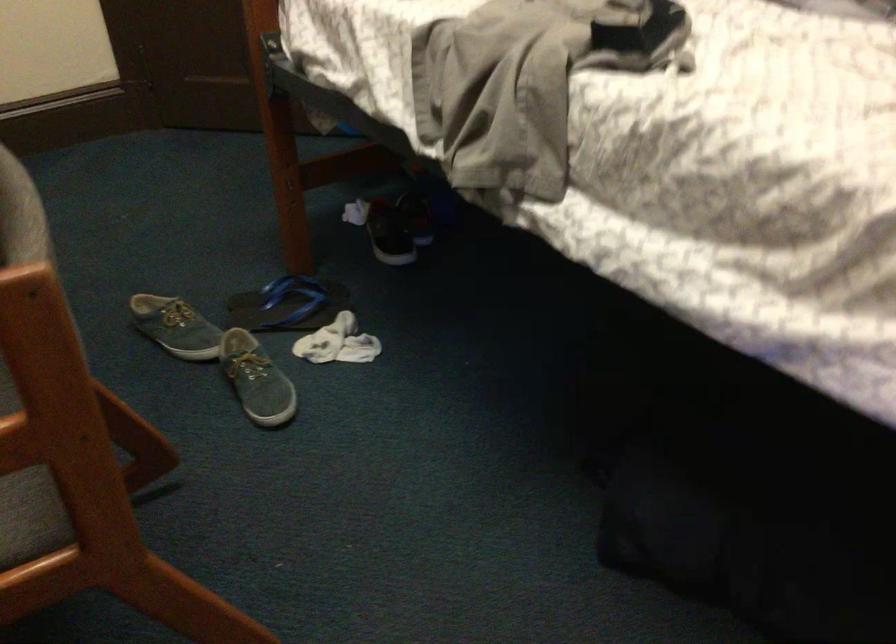
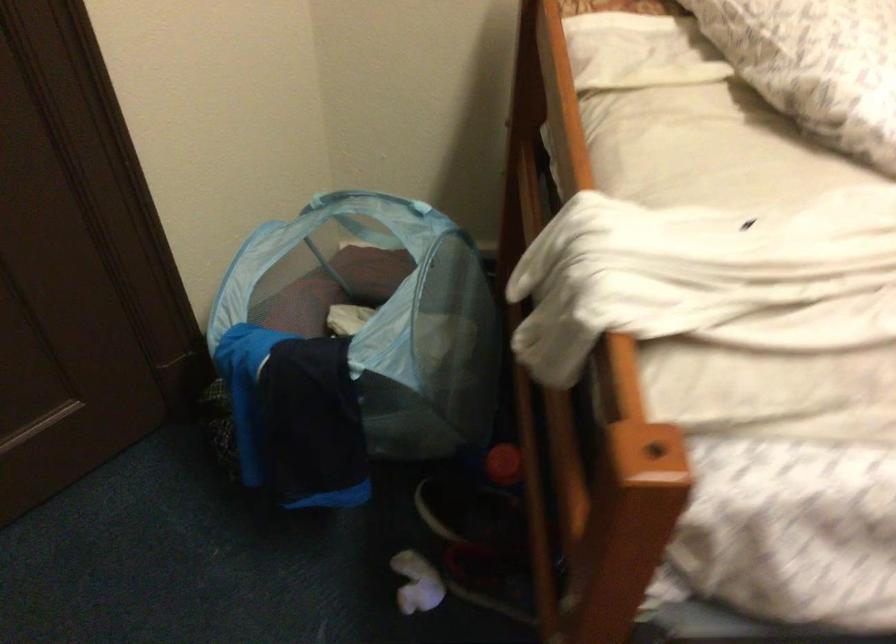
The point at (403, 194) is marked in the first image. Where is the corresponding point in the second image?

(469, 509)